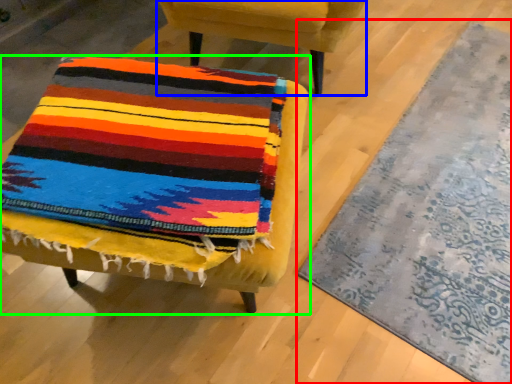
Question: Based on their relative distances, which object is nearer to mat (highlighted by a red box)? Choose from chair (highlighted by a blue box) and chair (highlighted by a green box).

Choices:
 (A) chair
 (B) chair

Answer: (B)